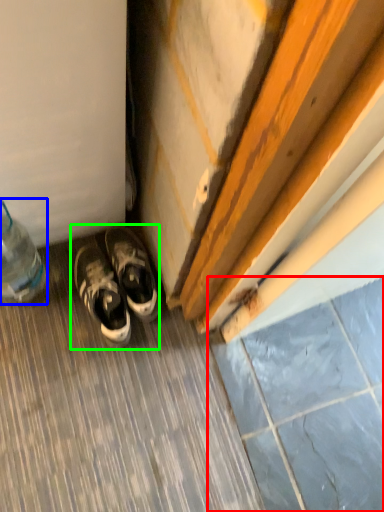
Question: Which object is the closest to the tile (highlighted by a red box)? Choose among these: bottle (highlighted by a blue box) or footwear (highlighted by a green box).

Choices:
 (A) bottle
 (B) footwear

Answer: (B)